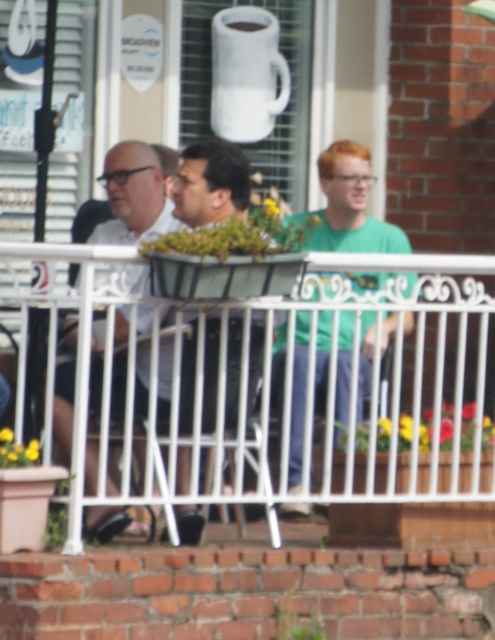
Question: Which of the following is the farthest from the observer?

Choices:
 (A) (164, 236)
 (B) (333, 212)
 (C) (440, 438)

Answer: (B)

Question: From the image, what is the correct spatial relationship of green matte shirt at center in relation to matte white shirt at center?

Choices:
 (A) above
 (B) below

Answer: (A)

Question: Which object is positioned farthest from the green matte shirt at center?

Choices:
 (A) matte black shirt at center
 (B) white wrought iron railing at center
 (C) matte white shirt at center

Answer: (C)

Question: In this image, where is green matte shirt at center located relative to matte white shirt at center?

Choices:
 (A) below
 (B) above

Answer: (B)

Question: Is white wrought iron railing at center below green matte shirt at center?

Choices:
 (A) yes
 (B) no

Answer: (A)

Question: Which point is closer to the camera?

Choices:
 (A) white wrought iron railing at center
 (B) green matte shirt at center

Answer: (A)